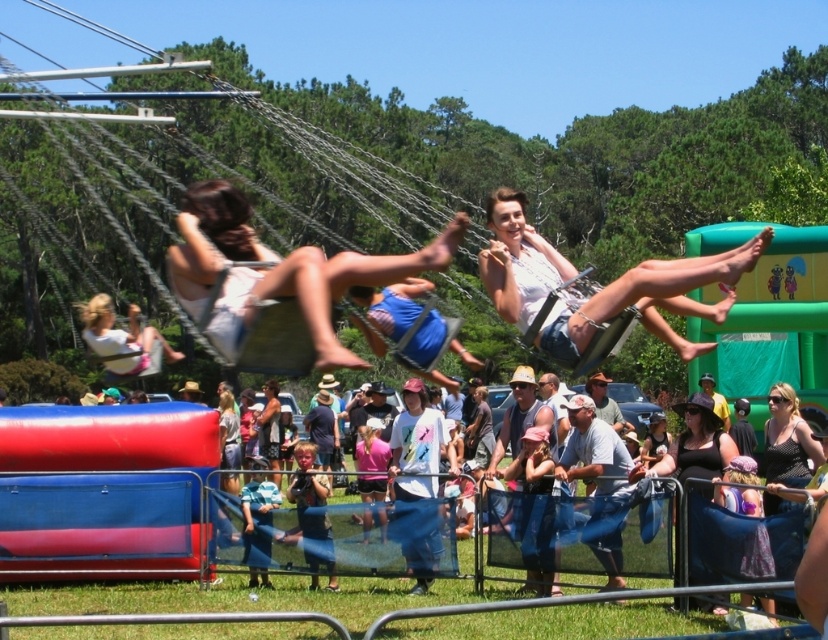
Which is below, matte black tank top at center or black dotted tank top at lower right?

matte black tank top at center is below.

Is matte black tank top at center taller than black dotted tank top at lower right?

Yes, matte black tank top at center is taller than black dotted tank top at lower right.

Image resolution: width=828 pixels, height=640 pixels. What do you see at coordinates (696, 444) in the screenshot?
I see `matte black tank top at center` at bounding box center [696, 444].

Locate an element on the screen. This screenshot has height=640, width=828. matte black tank top at center is located at coordinates (696, 444).

Describe the element at coordinates (277, 273) in the screenshot. This screenshot has width=828, height=640. I see `white fabric dress at center` at that location.

Who is more forward, [241,337] or [675,456]?

Point [241,337]

Image resolution: width=828 pixels, height=640 pixels. What are the coordinates of `white fabric dress at center` in the screenshot? It's located at (277, 273).

Does denim jeans at lower center appear under white cotton shirt at center?

Correct, denim jeans at lower center is located below white cotton shirt at center.

Is point (22, 433) positioned in front of point (499, 284)?

That is False.

Find the location of a particular element. The height and width of the screenshot is (640, 828). denim jeans at lower center is located at coordinates (116, 515).

The width and height of the screenshot is (828, 640). I want to click on denim jeans at lower center, so click(x=116, y=515).